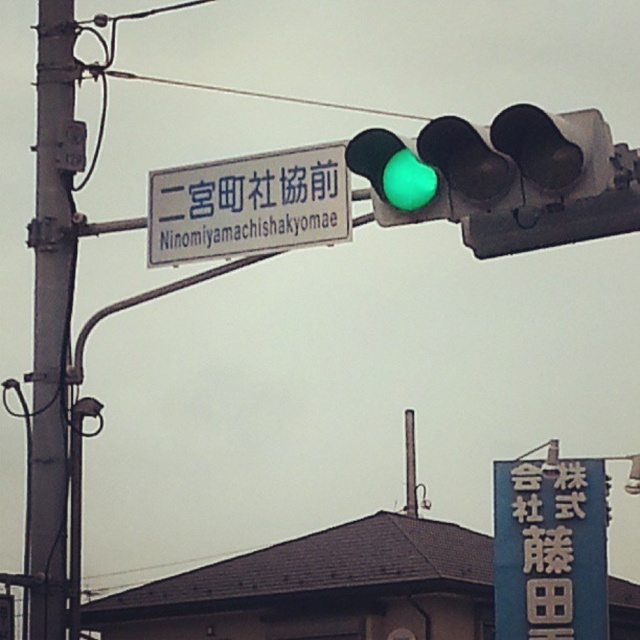
Does blue plastic sign at lower right appear over metallic wire at upper center?

Incorrect, blue plastic sign at lower right is not positioned above metallic wire at upper center.

Which is behind, point (525, 637) or point (426, 120)?

The point (426, 120) is behind.

Who is more forward, (518,637) or (124,77)?

Point (518,637) is in front.

I want to click on blue plastic sign at lower right, so click(x=548, y=548).

Is green glass traffic light at upper center shorter than blue plastic sign at lower right?

Yes.

Who is positioned more to the right, green glass traffic light at upper center or blue plastic sign at lower right?

blue plastic sign at lower right is more to the right.

Between point (374, 211) and point (584, 593), which one is positioned in front?

Positioned in front is point (374, 211).

Identify the location of green glass traffic light at upper center. This screenshot has width=640, height=640. 484,163.

Who is positioned more to the left, white plastic sign at upper center or metallic wire at upper center?

From the viewer's perspective, metallic wire at upper center appears more on the left side.

Does point (321, 180) come closer to viewer compared to point (225, 90)?

Yes, it is in front of point (225, 90).

This screenshot has height=640, width=640. Find the location of `white plastic sign at upper center`. white plastic sign at upper center is located at coordinates (248, 205).

The width and height of the screenshot is (640, 640). Find the location of `white plastic sign at upper center`. white plastic sign at upper center is located at coordinates tap(248, 205).